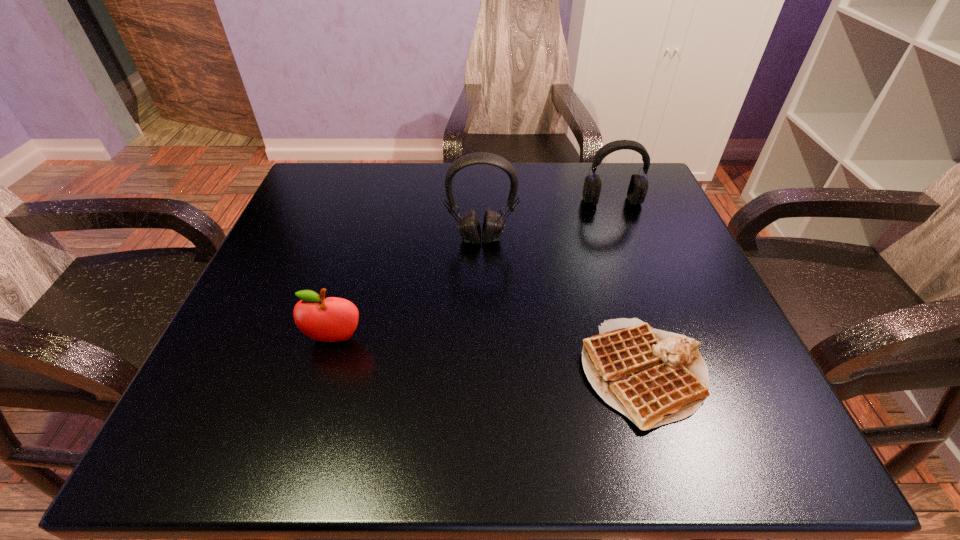
What are the coordinates of `vacant space located 0.260m on the left of the shortest object` in the screenshot? It's located at (413, 373).

The image size is (960, 540). Find the location of `object located at the far edge`. object located at the far edge is located at coordinates (638, 186).

This screenshot has width=960, height=540. I want to click on object that is at the near edge, so click(654, 377).

I want to click on object that is at the left edge, so click(x=332, y=319).

Where is `headset located at the right edge`? The height and width of the screenshot is (540, 960). headset located at the right edge is located at coordinates (638, 186).

Identify the location of waffle located in the right edge section of the desktop. This screenshot has width=960, height=540. (654, 377).

Locate an element on the screen. The height and width of the screenshot is (540, 960). object that is at the far right corner is located at coordinates (638, 186).

The height and width of the screenshot is (540, 960). I want to click on object present at the near right corner, so click(x=654, y=377).

The width and height of the screenshot is (960, 540). In the image, there is a desktop. What are the coordinates of `vacant area at the far edge` in the screenshot? It's located at (558, 182).

Locate an element on the screen. The height and width of the screenshot is (540, 960). vacant position at the left edge of the desktop is located at coordinates (267, 293).